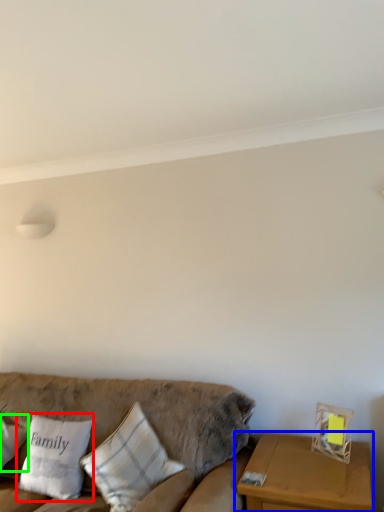
Question: Which object is positioned farthest from pillow (highlighted by a red box)? Select from table (highlighted by a blue box) and pillow (highlighted by a green box).

Choices:
 (A) table
 (B) pillow

Answer: (A)